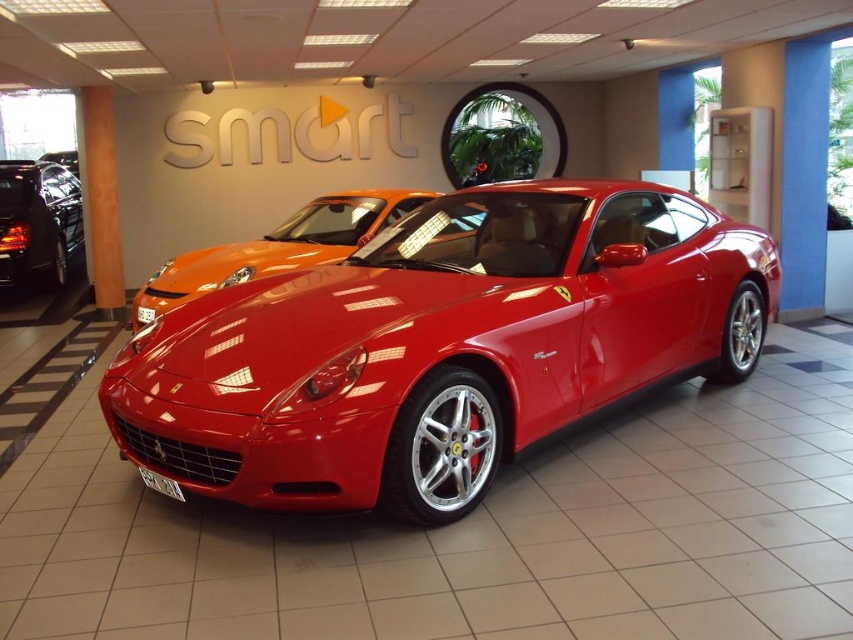
You are standing in the showroom and want to take a photo of both the red Ferrari and the orange sports car. You notice two points marked on the floor at coordinates point (395, 493) and point (71, 168). Which point should you stand at to ensure both cars are in your camera frame without needing to move?

You should stand at point (395, 493) because it is closer to the viewer, allowing you to capture both the red Ferrari in the foreground and the orange sports car in the background in a single frame without needing to move.

You are a photographer setting up a shoot in the showroom. You need to position a light source so that it illuminates both the shiny red sports car at center and the glossy black car at left without casting shadows between them. Given their heights, which car should the light be angled towards first?

The shiny red sports car at center is not as tall as the glossy black car at left. To avoid shadows between them, the light should first be angled towards the taller glossy black car at left, then adjusted to also illuminate the shorter shiny red sports car at center.

You are a delivery person needing to place a large package between the shiny red sports car at center and the glossy black car at left. The package requires 6 meters of space. Can you fit it there?

The distance between the shiny red sports car at center and the glossy black car at left is 7.00 meters, which is more than enough to accommodate the 6 meters required for the package.